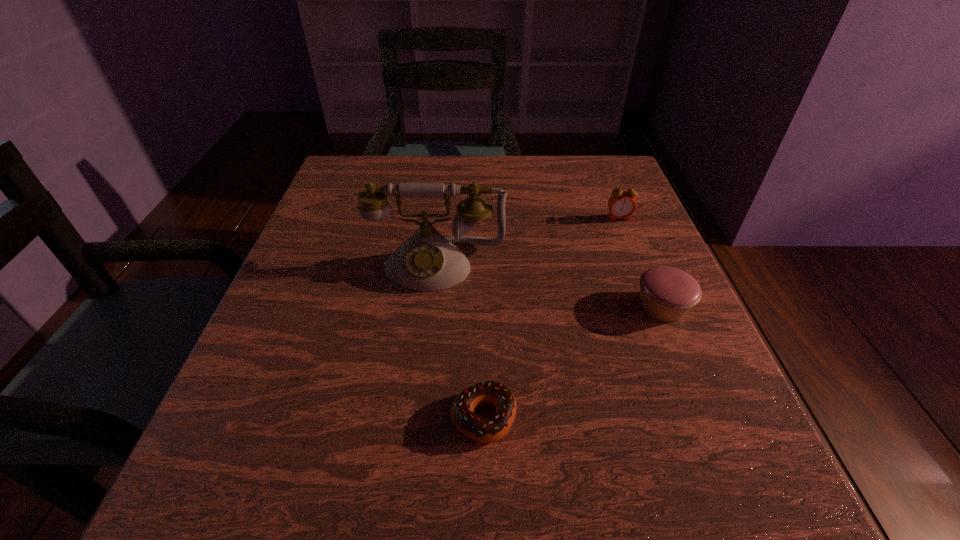
Identify the location of object positioned at the left edge. The image size is (960, 540). (427, 261).

The width and height of the screenshot is (960, 540). What are the coordinates of `alarm clock that is at the right edge` in the screenshot? It's located at (621, 204).

This screenshot has height=540, width=960. What are the coordinates of `cupcake located in the right edge section of the desktop` in the screenshot? It's located at pos(667,293).

Image resolution: width=960 pixels, height=540 pixels. Identify the location of free space at the far edge of the desktop. (511, 178).

Identify the location of vacant region at the left edge of the desktop. (324, 346).

In the image, there is a desktop. Find the location of `vacant space at the right edge`. vacant space at the right edge is located at coordinates (651, 228).

Where is `free space at the far left corner of the desktop`? Image resolution: width=960 pixels, height=540 pixels. free space at the far left corner of the desktop is located at coordinates (396, 171).

Locate an element on the screen. This screenshot has width=960, height=540. vacant space at the far right corner of the desktop is located at coordinates (597, 157).

Where is `blank space at the near right corner of the desktop`? The image size is (960, 540). blank space at the near right corner of the desktop is located at coordinates (684, 524).

At what (x,y) coordinates should I click in order to perform the action: click on free spot between the cupcake and the doughnut. Please return your answer as a coordinate pair (x, y). Image resolution: width=960 pixels, height=540 pixels. Looking at the image, I should click on (573, 362).